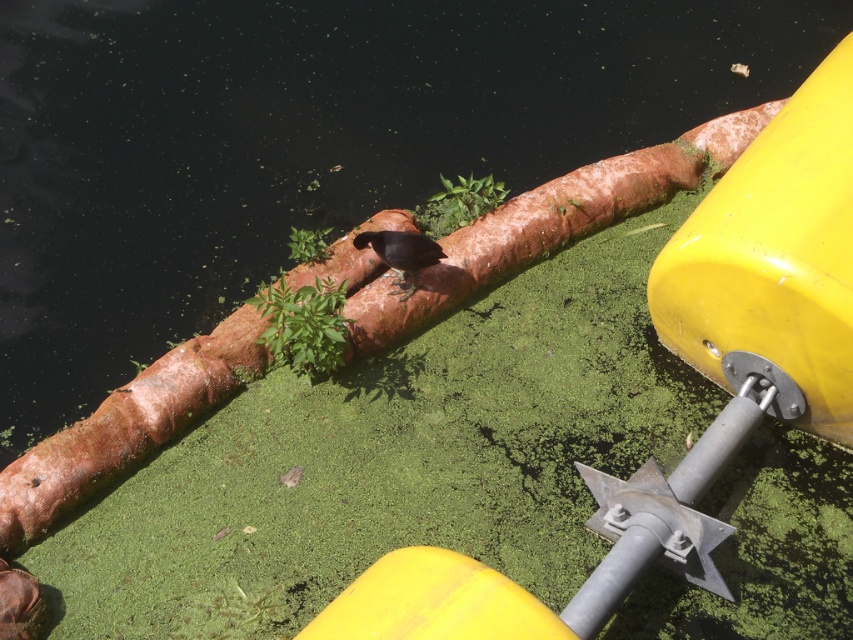
Question: Can you confirm if green algae water at center is positioned to the left of green mossy algae at center?

Choices:
 (A) yes
 (B) no

Answer: (B)

Question: Which of these objects is positioned farthest from the green mossy algae at center?

Choices:
 (A) shiny black bird at center
 (B) green algae water at center

Answer: (B)

Question: Which object is positioned closest to the green mossy algae at center?

Choices:
 (A) shiny black bird at center
 (B) green algae water at center

Answer: (A)

Question: Does green algae water at center lie in front of green mossy algae at center?

Choices:
 (A) no
 (B) yes

Answer: (B)

Question: Estimate the real-world distances between objects in this image. Which object is farther from the green mossy algae at center?

Choices:
 (A) green algae water at center
 (B) shiny black bird at center

Answer: (A)

Question: Does green algae water at center appear on the right side of green mossy algae at center?

Choices:
 (A) yes
 (B) no

Answer: (A)